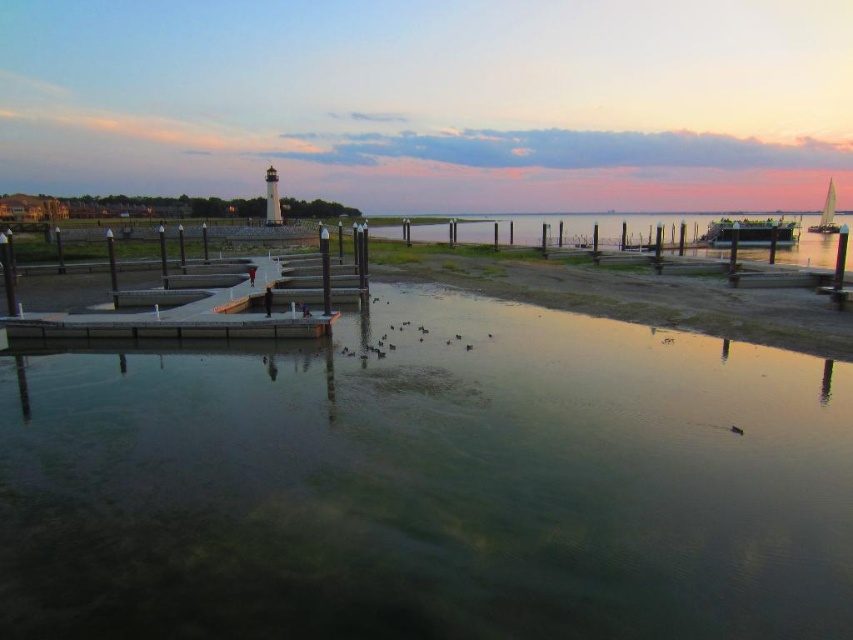
You are standing on the shore and want to reach the smooth concrete dock at center. If your maximum comfortable walking distance is 50 feet, can you comfortably walk to the dock without feeling strained?

The smooth concrete dock at center is 48.37 feet from viewer. Since this distance is within your 50 feet comfort zone, you can comfortably walk to the dock without feeling strained.

You are standing at the edge of the water and want to reach the smooth concrete dock at center. Which direction should you walk to get there?

You should walk towards the center to reach the smooth concrete dock at center since it is located at point (x=212, y=298).

You are standing on the dock and want to locate the metallic silver boat at center right. According to the coordinates provided, in which direction should you look relative to your position on the dock?

The metallic silver boat at center right is located at coordinates point (x=751, y=232). Since the dock is in the foreground and the boat is at center right, you should look towards the center right direction from your position on the dock to locate it.